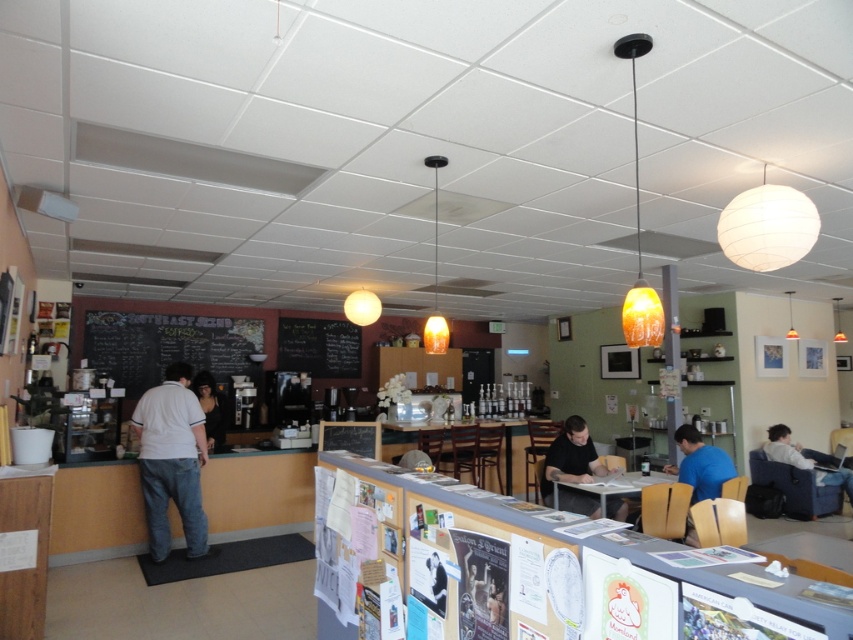
Question: Does white cotton shirt at center have a lesser width compared to black chalkboard at center?

Choices:
 (A) yes
 (B) no

Answer: (A)

Question: Considering the real-world distances, which object is farthest from the white glossy table at center?

Choices:
 (A) black matte shirt at center
 (B) white cotton shirt at center
 (C) black chalkboard at center
 (D) white paperboard bulletin board at center

Answer: (D)

Question: Is black chalkboard at center positioned before black matte shirt at center?

Choices:
 (A) yes
 (B) no

Answer: (B)

Question: Which of the following is the farthest from the observer?

Choices:
 (A) light blue fabric chair at lower right
 (B) black matte shirt at center

Answer: (A)

Question: Is black chalkboard at center below wooden table at center?

Choices:
 (A) yes
 (B) no

Answer: (B)

Question: Which point is farther from the camera taking this photo?

Choices:
 (A) (608, 515)
 (B) (288, 355)
 (C) (201, 332)
 (D) (434, 424)

Answer: (B)